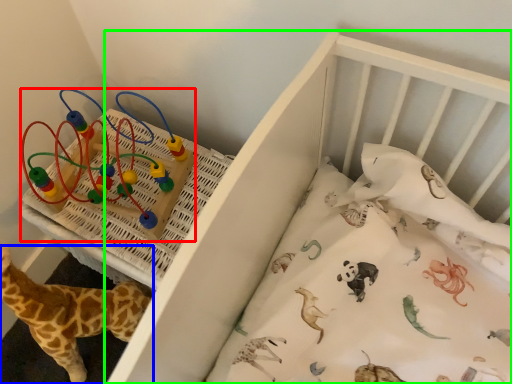
Question: Based on their relative distances, which object is farther from toy (highlighted by a red box)? Choose from giraffe (highlighted by a blue box) and infant bed (highlighted by a green box).

Choices:
 (A) giraffe
 (B) infant bed

Answer: (B)